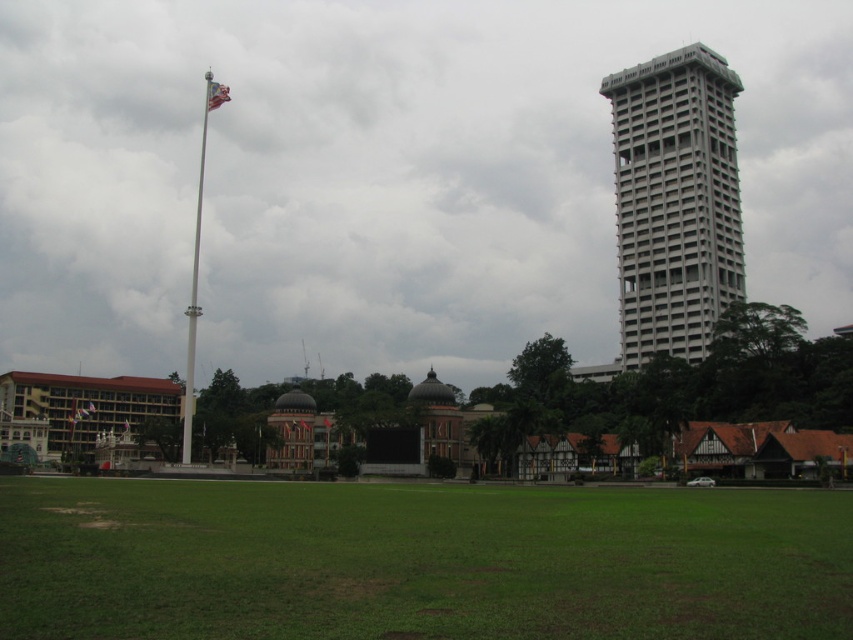
Between white concrete tower at upper right and white metallic flag pole at center, which one appears on the right side from the viewer's perspective?

Positioned to the right is white concrete tower at upper right.

Does white concrete tower at upper right come in front of white metallic flag pole at center?

No, white concrete tower at upper right is further to the viewer.

Where is `white concrete tower at upper right`? white concrete tower at upper right is located at coordinates pos(674,202).

Does green grass at lower center appear over white metallic flag pole at center?

No, green grass at lower center is not above white metallic flag pole at center.

Between green grass at lower center and white metallic flag pole at center, which one has less height?

green grass at lower center

I want to click on green grass at lower center, so click(x=418, y=561).

Is white metallic flag pole at center below silvery metallic flag at upper left?

Correct, white metallic flag pole at center is located below silvery metallic flag at upper left.

Does white metallic flag pole at center have a greater width compared to silvery metallic flag at upper left?

No, white metallic flag pole at center is not wider than silvery metallic flag at upper left.

Where is `white metallic flag pole at center`? The height and width of the screenshot is (640, 853). white metallic flag pole at center is located at coordinates (193, 298).